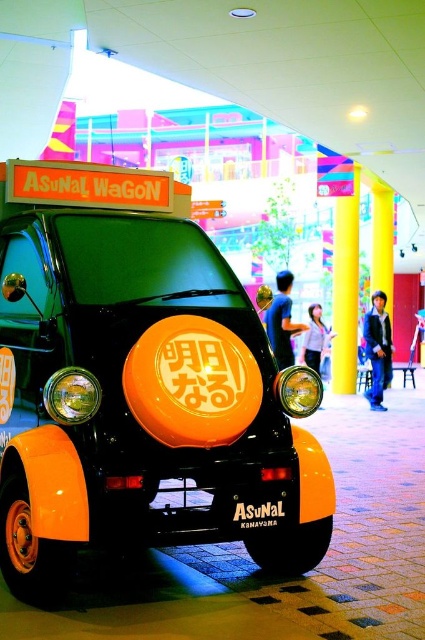
Question: Does orange matte vehicle at center lie in front of orange matte sign at center?

Choices:
 (A) yes
 (B) no

Answer: (A)

Question: Among these objects, which one is nearest to the camera?

Choices:
 (A) orange matte sign at center
 (B) orange matte vehicle at center

Answer: (B)

Question: Which point is farther from the camera taking this photo?

Choices:
 (A) (153, 458)
 (B) (241, 522)

Answer: (A)

Question: Does orange matte vehicle at center have a greater width compared to orange matte sign at center?

Choices:
 (A) yes
 (B) no

Answer: (A)

Question: Is orange matte vehicle at center to the left of orange matte sign at center from the viewer's perspective?

Choices:
 (A) no
 (B) yes

Answer: (B)